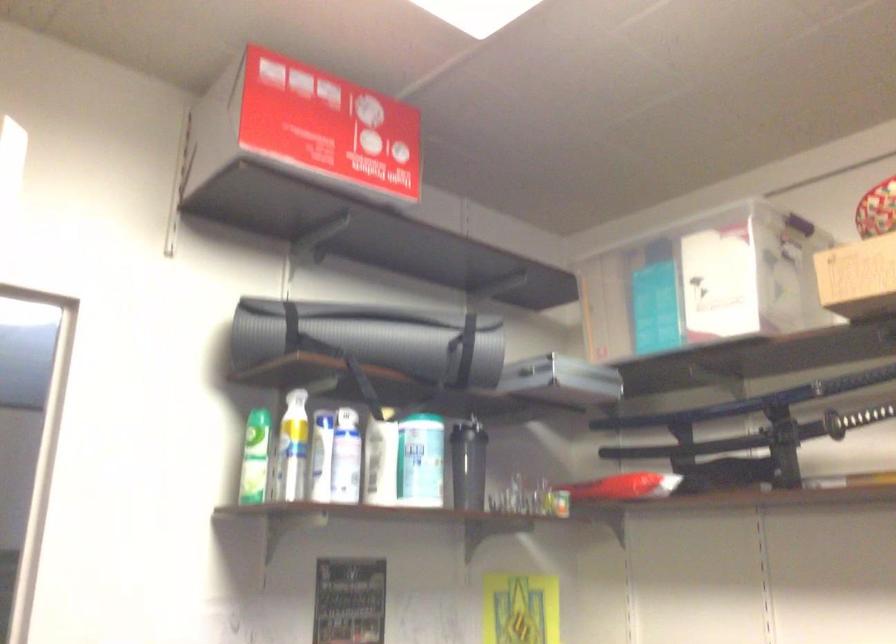
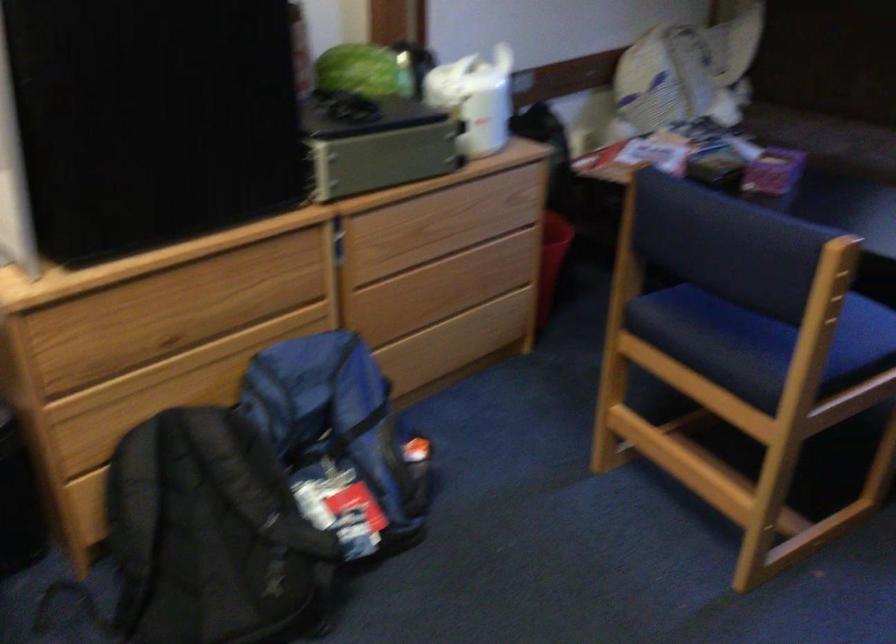
The first image is from the beginning of the video and the second image is from the end. How did the camera likely rotate when shooting the video?

The camera's rotation is toward right-down.